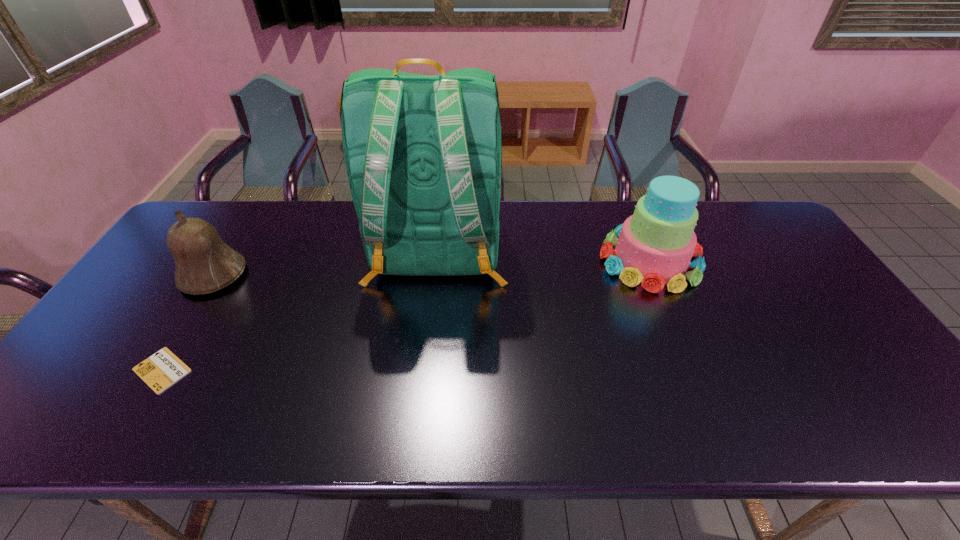
Identify the location of free space between the cake and the second object from right to left. (543, 257).

The height and width of the screenshot is (540, 960). Identify the location of free space between the backpack and the nearest object. (300, 312).

You are a GUI agent. You are given a task and a screenshot of the screen. Output one action in this format:
    pyautogui.click(x=<x>, y=<y>)
    Task: Click on the vacant area between the tallest object and the cake
    This screenshot has height=540, width=960.
    Given the screenshot: What is the action you would take?
    pyautogui.click(x=543, y=257)

Where is `free space between the rightmost object and the shortest object`? The image size is (960, 540). free space between the rightmost object and the shortest object is located at coordinates (406, 315).

Locate an element on the screen. free space that is in between the third object from left to right and the identity card is located at coordinates (300, 312).

The height and width of the screenshot is (540, 960). Find the location of `blank region between the cake and the nearest object`. blank region between the cake and the nearest object is located at coordinates (406, 315).

Find the location of `vacant region between the nearest object and the rightmost object`. vacant region between the nearest object and the rightmost object is located at coordinates (406, 315).

This screenshot has height=540, width=960. I want to click on vacant space that's between the identity card and the bell, so click(x=187, y=322).

Identify the location of free space between the tallest object and the bell. (325, 265).

You are a GUI agent. You are given a task and a screenshot of the screen. Output one action in this format:
    pyautogui.click(x=<x>, y=<y>)
    Task: Click on the object that is the second closest to the third object from left to right
    The image size is (960, 540).
    Given the screenshot: What is the action you would take?
    pyautogui.click(x=203, y=262)